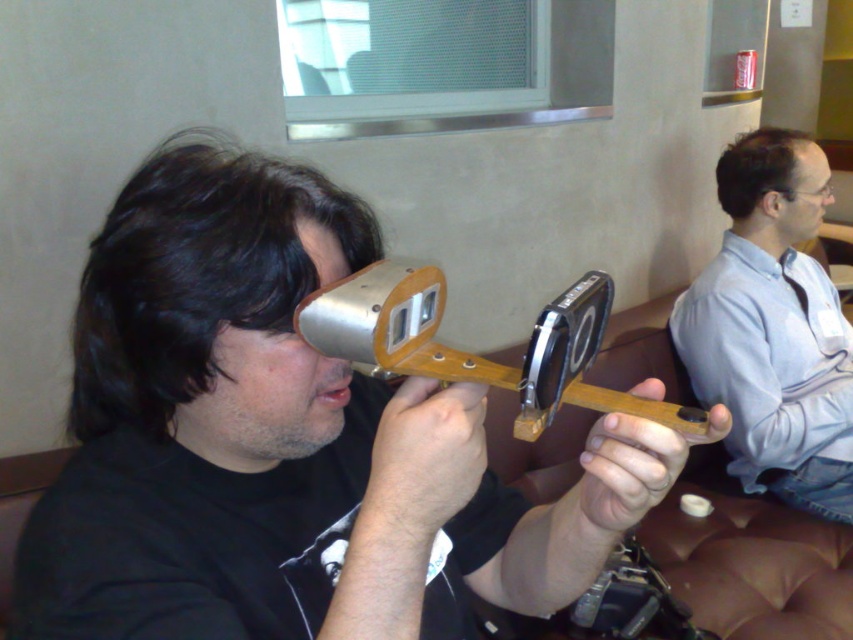
Can you confirm if matte black device at center is positioned to the right of metal/wooden tool at center?

Incorrect, matte black device at center is not on the right side of metal/wooden tool at center.

Can you confirm if matte black device at center is shorter than metal/wooden tool at center?

No.

Who is more forward, (105, 634) or (546, 412)?

Point (546, 412)

What are the coordinates of `matte black device at center` in the screenshot? It's located at (283, 442).

Does matte black device at center have a larger size compared to light blue shirt at right?

Actually, matte black device at center might be smaller than light blue shirt at right.

Which is in front, point (372, 621) or point (821, 360)?

Positioned in front is point (372, 621).

Who is more distant from viewer, (277, 602) or (769, 296)?

The point (769, 296) is more distant.

You are a GUI agent. You are given a task and a screenshot of the screen. Output one action in this format:
    pyautogui.click(x=<x>, y=<y>)
    Task: Click on the matte black device at center
    This screenshot has height=640, width=853.
    Given the screenshot: What is the action you would take?
    pyautogui.click(x=283, y=442)

Who is positioned more to the left, light blue shirt at right or metal/wooden tool at center?

Positioned to the left is metal/wooden tool at center.

Is light blue shirt at right thinner than metal/wooden tool at center?

No, light blue shirt at right is not thinner than metal/wooden tool at center.

Who is more distant from viewer, (848, 410) or (419, 349)?

Positioned behind is point (848, 410).

The width and height of the screenshot is (853, 640). In order to click on light blue shirt at right in this screenshot , I will do `click(773, 328)`.